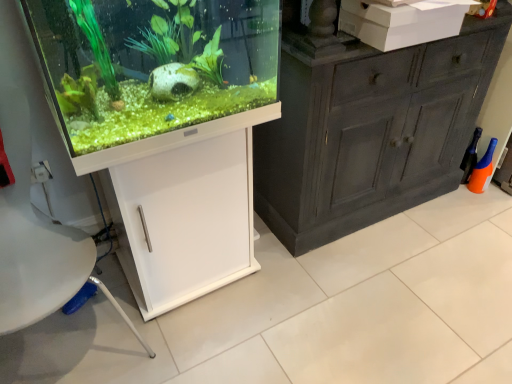
Question: Does white matte cabinet at lower left have a greater width compared to white cardboard box at upper right?

Choices:
 (A) no
 (B) yes

Answer: (B)

Question: Considering the relative positions of white matte cabinet at lower left and white cardboard box at upper right in the image provided, is white matte cabinet at lower left to the right of white cardboard box at upper right from the viewer's perspective?

Choices:
 (A) yes
 (B) no

Answer: (B)

Question: Considering the relative positions of white matte cabinet at lower left and white cardboard box at upper right in the image provided, is white matte cabinet at lower left to the left of white cardboard box at upper right from the viewer's perspective?

Choices:
 (A) yes
 (B) no

Answer: (A)

Question: Is white matte cabinet at lower left behind white cardboard box at upper right?

Choices:
 (A) no
 (B) yes

Answer: (A)

Question: Is white matte cabinet at lower left outside of white cardboard box at upper right?

Choices:
 (A) no
 (B) yes

Answer: (B)

Question: Would you say white matte cabinet at lower left contains white cardboard box at upper right?

Choices:
 (A) yes
 (B) no

Answer: (B)

Question: From a real-world perspective, is white cardboard box at upper right on top of white matte cabinet at lower left?

Choices:
 (A) yes
 (B) no

Answer: (A)

Question: Is white cardboard box at upper right looking in the opposite direction of white matte cabinet at lower left?

Choices:
 (A) no
 (B) yes

Answer: (A)

Question: Considering the relative sizes of white cardboard box at upper right and white matte cabinet at lower left in the image provided, is white cardboard box at upper right shorter than white matte cabinet at lower left?

Choices:
 (A) yes
 (B) no

Answer: (A)

Question: Is white cardboard box at upper right facing towards white matte cabinet at lower left?

Choices:
 (A) no
 (B) yes

Answer: (A)

Question: From a real-world perspective, is white cardboard box at upper right physically below white matte cabinet at lower left?

Choices:
 (A) yes
 (B) no

Answer: (B)

Question: Is white cardboard box at upper right to the left of white matte cabinet at lower left from the viewer's perspective?

Choices:
 (A) yes
 (B) no

Answer: (B)

Question: Is point pyautogui.click(x=154, y=160) positioned closer to the camera than point pyautogui.click(x=353, y=29)?

Choices:
 (A) closer
 (B) farther

Answer: (A)